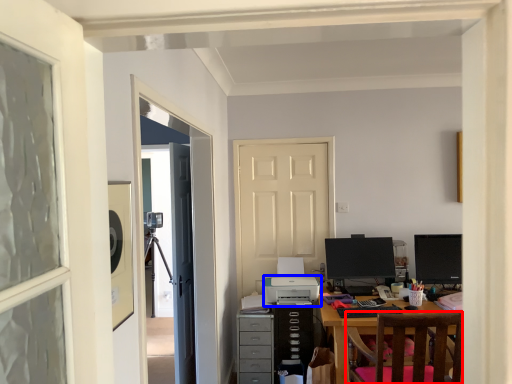
Question: Which point is further to the camera, chair (highlighted by a red box) or printer (highlighted by a blue box)?

Choices:
 (A) chair
 (B) printer

Answer: (B)